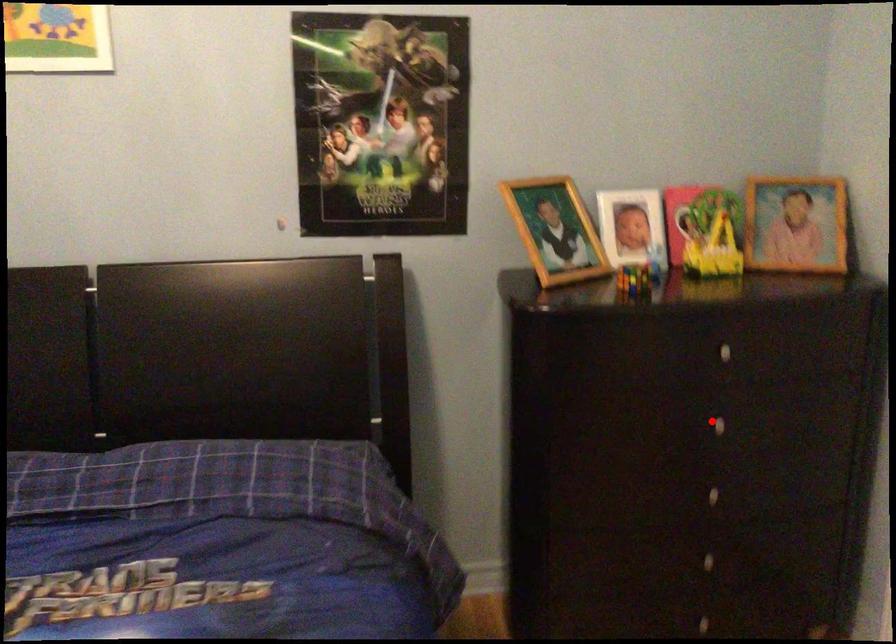
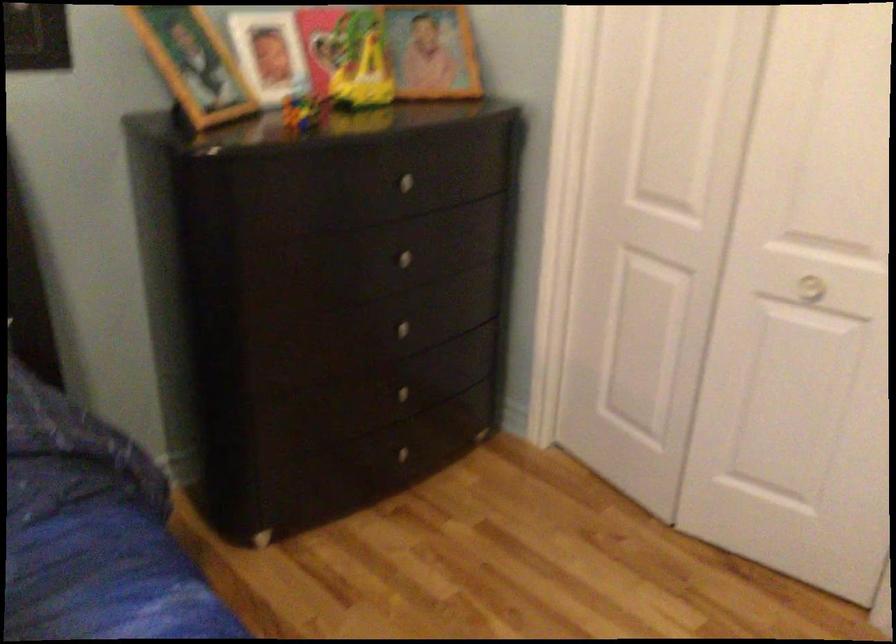
Find the pixel in the second image that matches the highlighted location in the first image.

(399, 258)